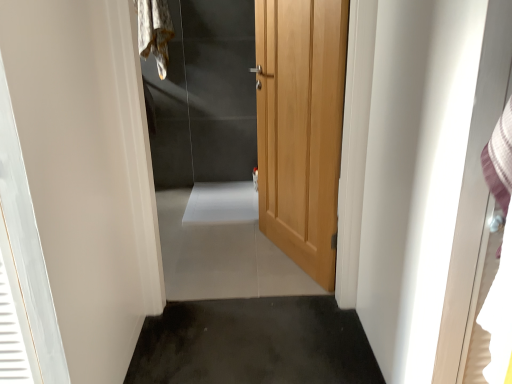
Question: Would you say white glossy screen door at right contains light wood door at center?

Choices:
 (A) yes
 (B) no

Answer: (B)

Question: Does white glossy screen door at right touch light wood door at center?

Choices:
 (A) no
 (B) yes

Answer: (A)

Question: From a real-world perspective, is white glossy screen door at right physically above light wood door at center?

Choices:
 (A) yes
 (B) no

Answer: (A)

Question: From a real-world perspective, is white glossy screen door at right under light wood door at center?

Choices:
 (A) yes
 (B) no

Answer: (B)

Question: Is the position of white glossy screen door at right more distant than that of light wood door at center?

Choices:
 (A) yes
 (B) no

Answer: (B)

Question: In terms of height, does fuzzy fabric laundry at upper left look taller or shorter compared to light wood door at center?

Choices:
 (A) tall
 (B) short

Answer: (B)

Question: From a real-world perspective, is fuzzy fabric laundry at upper left positioned above or below light wood door at center?

Choices:
 (A) below
 (B) above

Answer: (B)

Question: Based on their sizes in the image, would you say fuzzy fabric laundry at upper left is bigger or smaller than light wood door at center?

Choices:
 (A) small
 (B) big

Answer: (A)

Question: Is fuzzy fabric laundry at upper left inside or outside of light wood door at center?

Choices:
 (A) outside
 (B) inside

Answer: (A)

Question: From a real-world perspective, is dark gray concrete at lower center above or below light wood door at center?

Choices:
 (A) above
 (B) below

Answer: (B)

Question: Considering the positions of dark gray concrete at lower center and light wood door at center in the image, is dark gray concrete at lower center taller or shorter than light wood door at center?

Choices:
 (A) short
 (B) tall

Answer: (A)

Question: From the image's perspective, relative to light wood door at center, is dark gray concrete at lower center above or below?

Choices:
 (A) above
 (B) below

Answer: (B)

Question: In terms of width, does dark gray concrete at lower center look wider or thinner when compared to light wood door at center?

Choices:
 (A) thin
 (B) wide

Answer: (B)

Question: In terms of height, does wooden door at center look taller or shorter compared to light wood door at center?

Choices:
 (A) tall
 (B) short

Answer: (B)

Question: From a real-world perspective, is wooden door at center positioned above or below light wood door at center?

Choices:
 (A) above
 (B) below

Answer: (B)